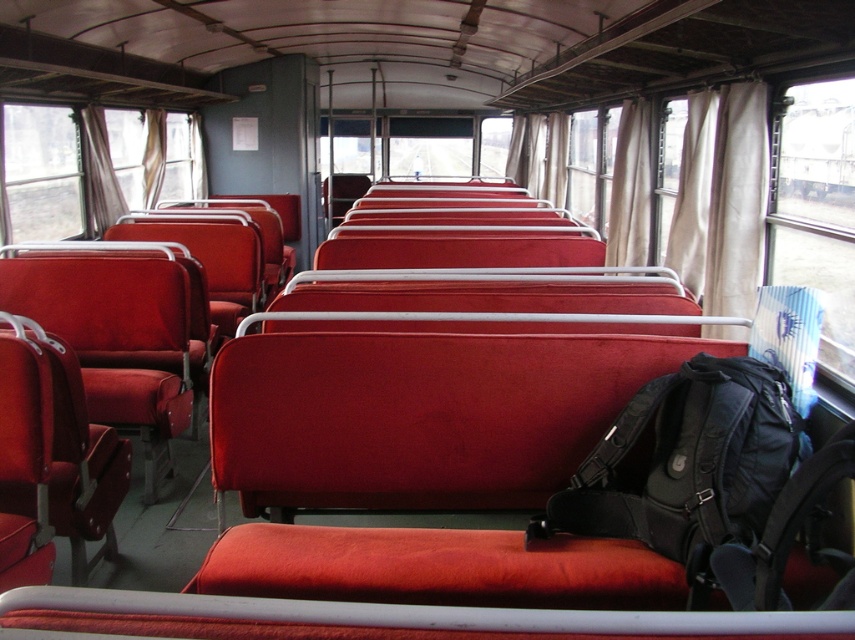
Question: Can you confirm if transparent fabric window at upper left is thinner than transparent glass window at left?

Choices:
 (A) no
 (B) yes

Answer: (A)

Question: Observing the image, what is the correct spatial positioning of transparent fabric window at upper left in reference to transparent glass window at left?

Choices:
 (A) left
 (B) right

Answer: (A)

Question: Does transparent fabric window at upper left appear on the right side of transparent glass window at left?

Choices:
 (A) yes
 (B) no

Answer: (B)

Question: Which point appears closest to the camera in this image?

Choices:
 (A) (12, 218)
 (B) (134, 141)

Answer: (A)